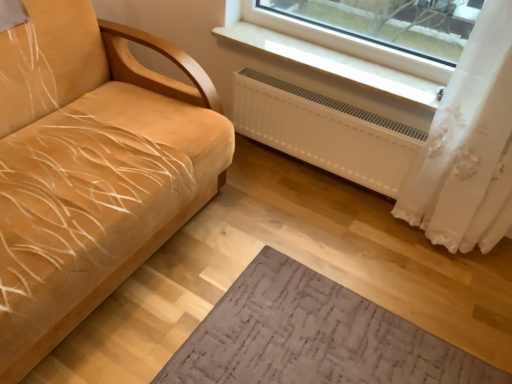
This screenshot has height=384, width=512. I want to click on vacant space underneath white sheer curtain at right (from a real-world perspective), so click(x=419, y=237).